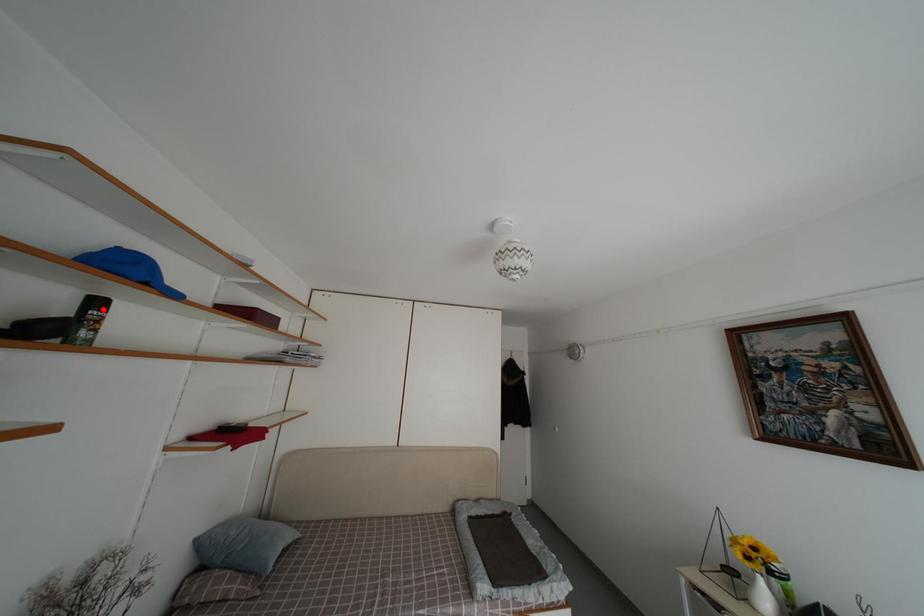
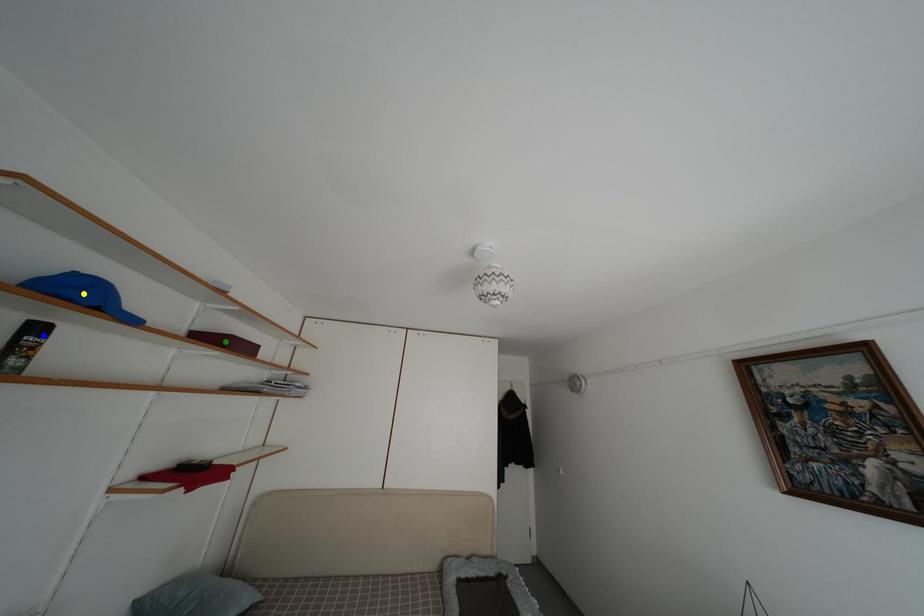
Question: I am providing you with two images of the same scene from different viewpoints. A red point is marked on the first image. You are given multiple points on the second image. In image 2, which mark is for the same physical point as the one in image 1?

Choices:
 (A) yellow point
 (B) green point
 (C) blue point

Answer: (C)